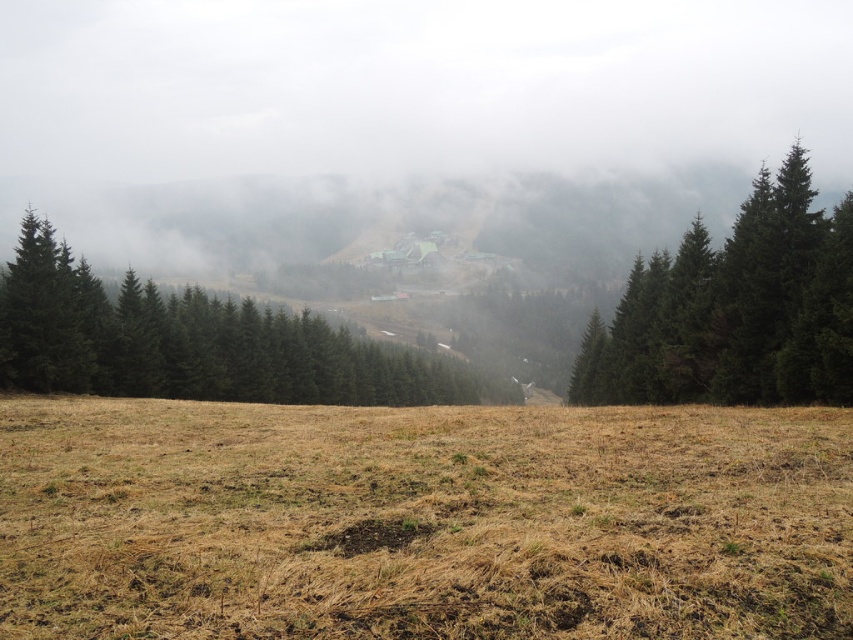
Can you confirm if brown grass at center is positioned to the left of dark green textured tree at right?

Correct, you'll find brown grass at center to the left of dark green textured tree at right.

Who is more distant from viewer, (643, 460) or (619, 307)?

The point (619, 307) is behind.

Locate an element on the screen. The image size is (853, 640). brown grass at center is located at coordinates (422, 520).

Is brown grass at center to the right of green matte trees at center from the viewer's perspective?

Yes, brown grass at center is to the right of green matte trees at center.

Which is behind, point (341, 461) or point (265, 394)?

The point (265, 394) is behind.

The height and width of the screenshot is (640, 853). I want to click on brown grass at center, so click(x=422, y=520).

Which is below, green matte trees at center or dark green textured tree at right?

Positioned lower is green matte trees at center.

Does point (54, 353) come behind point (584, 356)?

That is False.

You are a GUI agent. You are given a task and a screenshot of the screen. Output one action in this format:
    pyautogui.click(x=<x>, y=<y>)
    Task: Click on the green matte trees at center
    
    Given the screenshot: What is the action you would take?
    pyautogui.click(x=198, y=342)